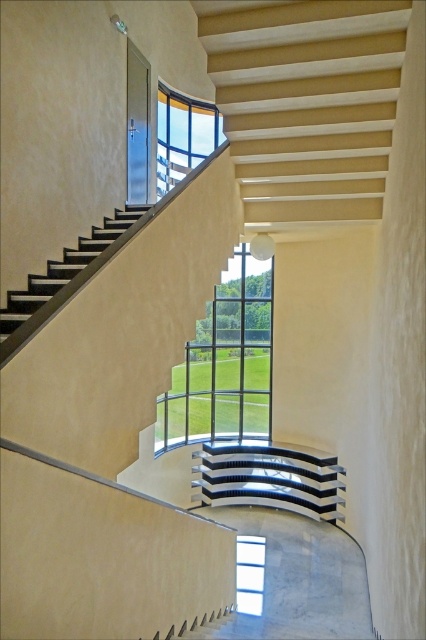
You are an interior designer trying to place a large painting between the clear glass window at center and the transparent glass window at center. Since both windows are at the center, how do you determine where to place the painting?

The clear glass window at center has a larger width than the transparent glass window at center, so the painting should be placed between them in the space where the clear glass window at center is wider.

You are standing on the smooth beige stairs at lower center and want to look out through the clear glass window at upper center. Which direction should you move to reach the window?

The clear glass window at upper center is above the smooth beige stairs at lower center, so you should move upward to reach the window.

You are standing at the bottom of the staircase and want to take a photo of both the point at coordinates point (294, 506) and point (181, 628). Which point should you focus on first to ensure both are in focus?

You should focus on point (294, 506) first because it is closer to the camera than point (181, 628). This ensures both points will be in focus as the closer point determines the focal plane.